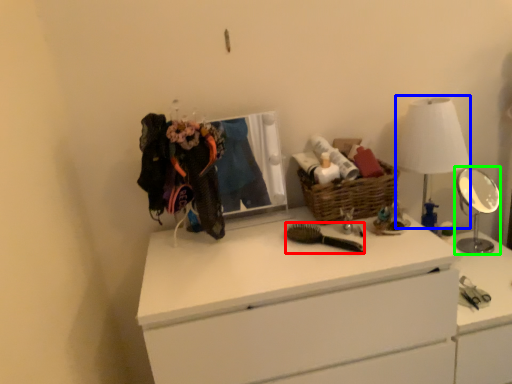
Question: Which is nearer to the brush (highlighted by a red box)? table lamp (highlighted by a blue box) or mirror (highlighted by a green box).

Choices:
 (A) table lamp
 (B) mirror

Answer: (A)